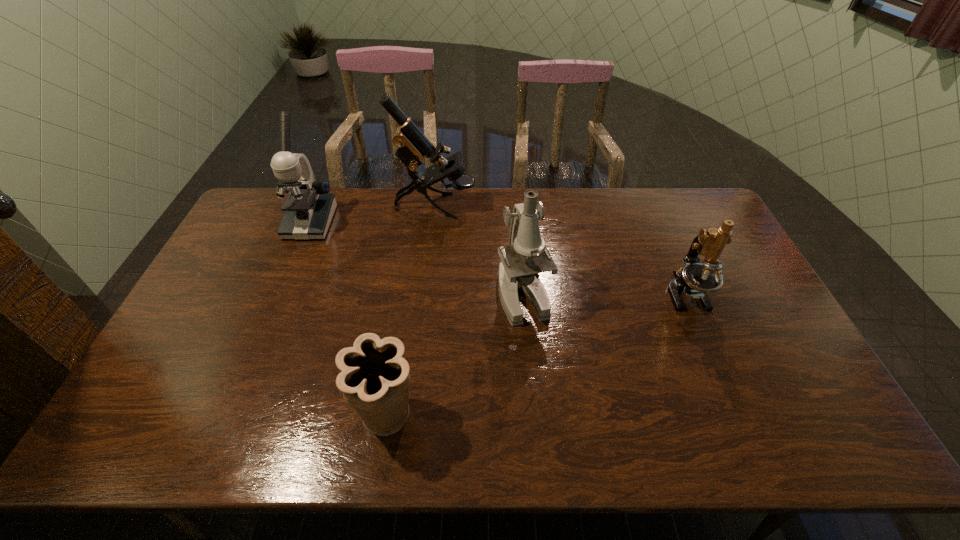
Locate an element on the screen. Image resolution: width=960 pixels, height=540 pixels. vacant point located between the leftmost object and the shortest object is located at coordinates pyautogui.click(x=348, y=319).

Where is `empty space that is in between the leftmost object and the shortest microscope`? The image size is (960, 540). empty space that is in between the leftmost object and the shortest microscope is located at coordinates (497, 258).

The width and height of the screenshot is (960, 540). I want to click on vacant space in between the fourth object from left to right and the second microscope from left to right, so (x=479, y=251).

Identify the location of free area in between the leftmost microscope and the urn. This screenshot has width=960, height=540. (348, 319).

What are the coordinates of `free space between the nearest object and the second shortest object` in the screenshot? It's located at (537, 355).

Image resolution: width=960 pixels, height=540 pixels. Find the location of `vacant space that is in between the second microscope from left to right and the leftmost microscope`. vacant space that is in between the second microscope from left to right and the leftmost microscope is located at coordinates (372, 214).

Image resolution: width=960 pixels, height=540 pixels. Find the location of `empty space between the urn and the third microscope from right to left`. empty space between the urn and the third microscope from right to left is located at coordinates coord(412,310).

This screenshot has height=540, width=960. I want to click on empty space that is in between the rightmost microscope and the urn, so click(x=537, y=355).

Locate an element on the screen. unoccupied area between the second microscope from left to right and the rightmost microscope is located at coordinates (561, 249).

The width and height of the screenshot is (960, 540). What are the coordinates of `object that is the second closest to the leftmost object` in the screenshot? It's located at (526, 255).